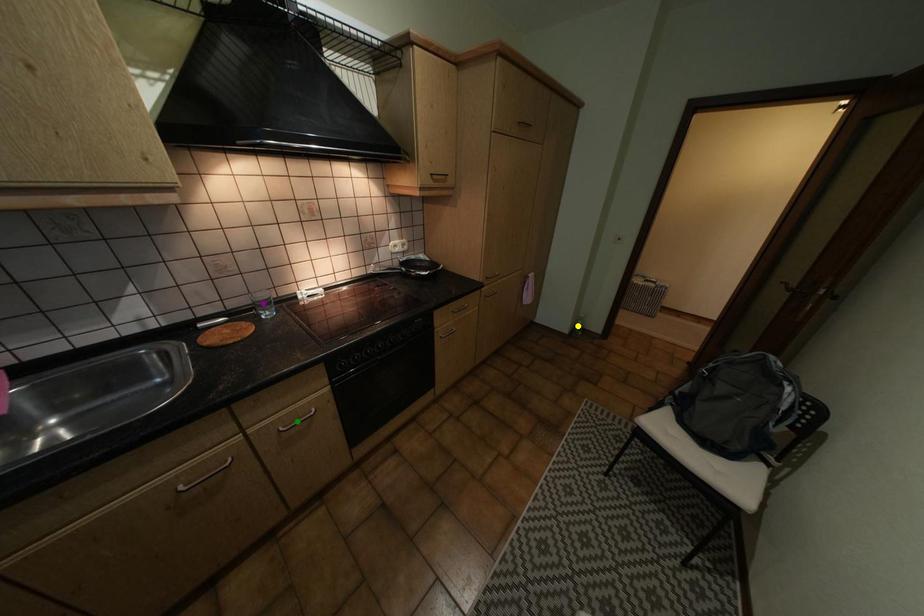
Order these from nearest to farthest:
yellow point
purple point
green point

green point, purple point, yellow point